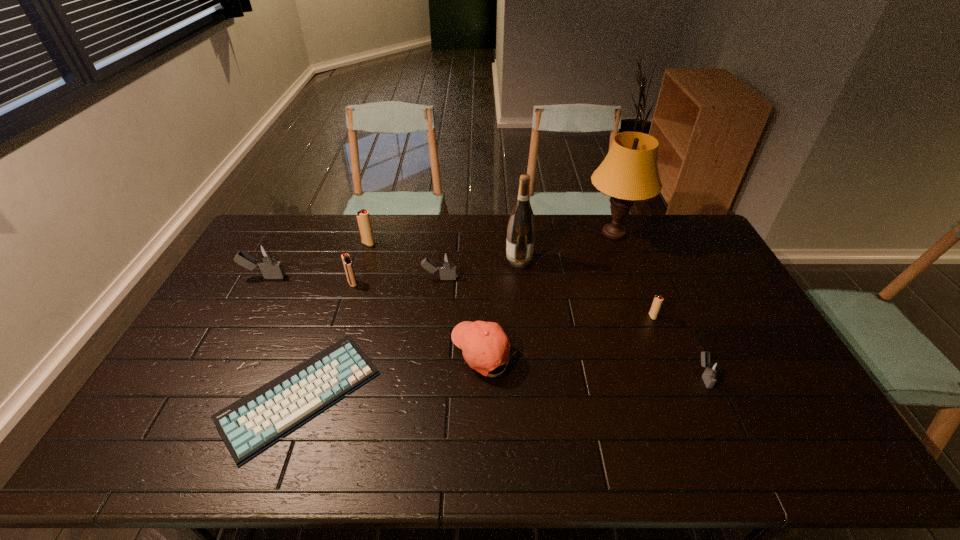
Select which igniter is the fourth closest to the leftmost gray igniter. Please provide its 2D coordinates. Your answer should be formatted as a tuple, i.e. [(x, y)], where the tuple contains the x and y coordinates of a point satisfying the conditions above.

[(658, 300)]

Identify the location of igniter that is the third closest to the biggest red igniter. (266, 258).

Locate an element on the screen. red igniter object that ranks as the second closest to the nearest igniter is located at coordinates (348, 266).

Locate an element on the screen. the third closest red igniter to the leftmost igniter is located at coordinates (658, 300).

Locate an element on the screen. The width and height of the screenshot is (960, 540). gray igniter that can be found as the closest to the second igniter from right to left is located at coordinates (712, 368).

Select which gray igniter is the third closest to the fifth farthest igniter. Please provide its 2D coordinates. Your answer should be formatted as a tuple, i.e. [(x, y)], where the tuple contains the x and y coordinates of a point satisfying the conditions above.

[(266, 258)]